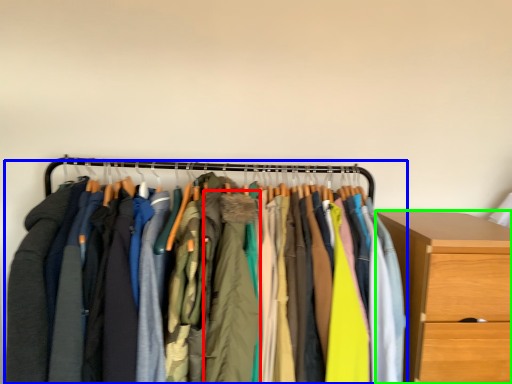
Question: Which object is positioned farthest from clothing (highlighted by a red box)? Select from closet (highlighted by a blue box) and chest of drawers (highlighted by a green box).

Choices:
 (A) closet
 (B) chest of drawers

Answer: (B)